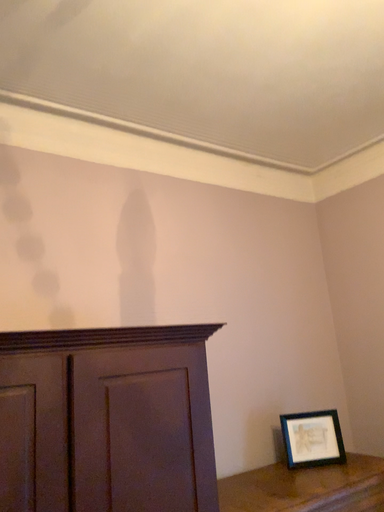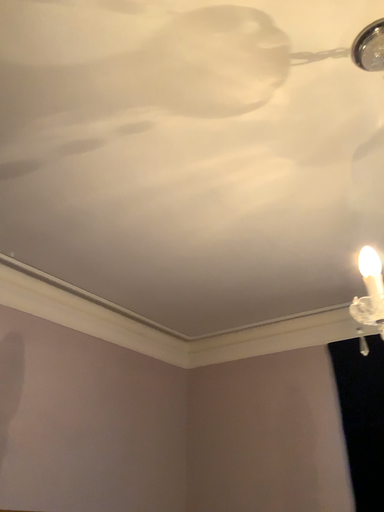
Question: How did the camera likely rotate when shooting the video?

Choices:
 (A) rotated upward
 (B) rotated downward

Answer: (A)